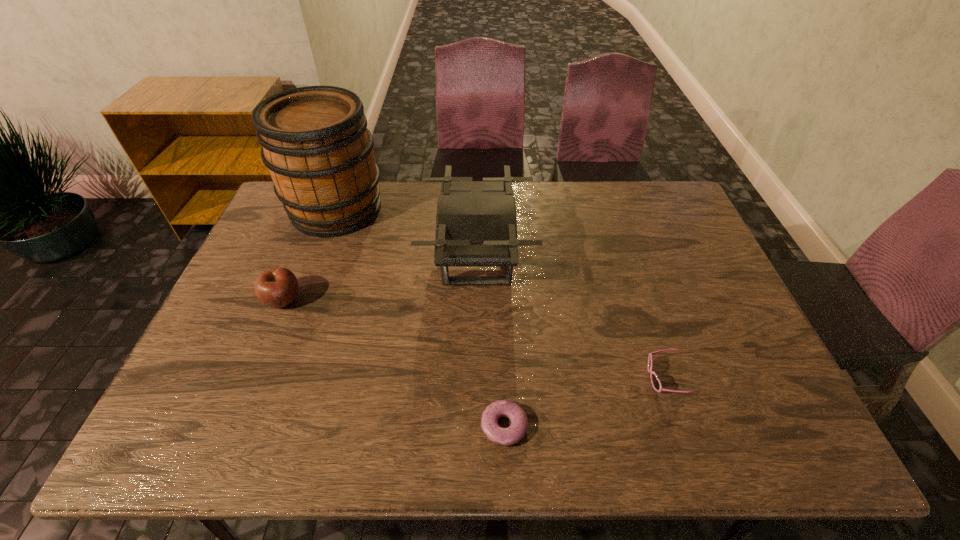
Where is `vacant point located between the drone and the apple`? This screenshot has height=540, width=960. vacant point located between the drone and the apple is located at coordinates (380, 278).

I want to click on free spot between the sunglasses and the fourth shortest object, so 570,318.

Locate an element on the screen. vacant space in between the cider and the rightmost object is located at coordinates (500, 294).

Locate an element on the screen. free space between the cider and the fourth farthest object is located at coordinates (500, 294).

I want to click on free space between the sunglasses and the cider, so click(x=500, y=294).

I want to click on vacant space that is in between the nearest object and the fourth tallest object, so click(x=584, y=402).

The image size is (960, 540). What are the coordinates of `the third closest object relative to the nearest object` in the screenshot? It's located at (278, 287).

This screenshot has height=540, width=960. Identify the location of object that stands as the fourth closest to the drone. (278, 287).

This screenshot has height=540, width=960. In order to click on free space in the image that satisfies the following two spatial constraints: 1. on the front side of the tallest object; 2. on the side of the third tallest object with the unique marking in this screenshot , I will do `click(302, 300)`.

Find the location of `vacant space that satisfies the following two spatial constraints: 1. on the side of the apple with the unique marking; 2. on the right side of the doughnut`. vacant space that satisfies the following two spatial constraints: 1. on the side of the apple with the unique marking; 2. on the right side of the doughnut is located at coordinates (231, 426).